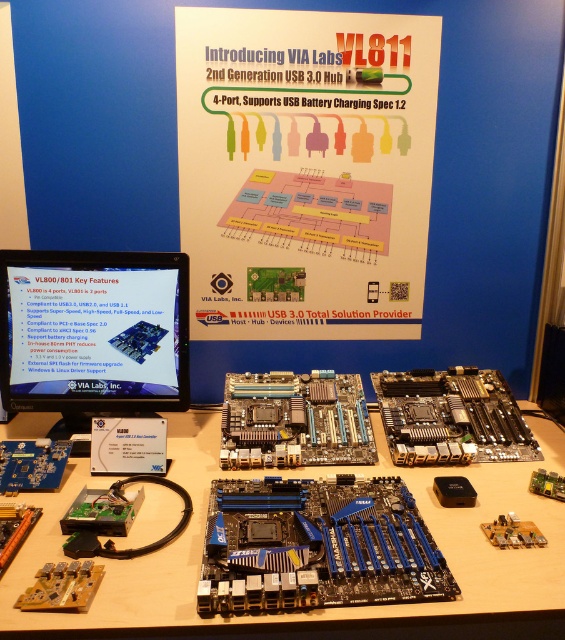
Question: Which object appears closest to the camera in this image?

Choices:
 (A) silver metallic motherboard at center
 (B) blue metallic motherboard at center
 (C) white paper at center

Answer: (B)

Question: Is white paper at center positioned before matte black monitor at center?

Choices:
 (A) yes
 (B) no

Answer: (B)

Question: Which of the following is the closest to the observer?

Choices:
 (A) matte black monitor at center
 (B) black metallic motherboard at center
 (C) blue metallic motherboard at center
 (D) white paper at center

Answer: (C)

Question: Which point is farther to the camera?

Choices:
 (A) (371, 524)
 (B) (481, 404)

Answer: (B)

Question: Does matte black monitor at center appear on the right side of blue metallic motherboard at center?

Choices:
 (A) yes
 (B) no

Answer: (B)

Question: Can you confirm if blue metallic motherboard at center is positioned to the right of silver metallic motherboard at center?

Choices:
 (A) yes
 (B) no

Answer: (A)